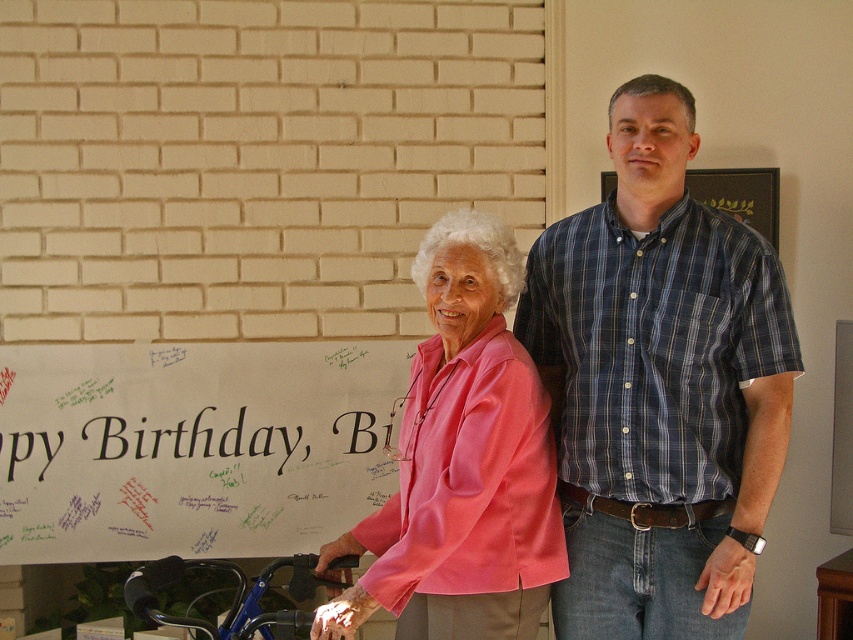
Question: Does blue plaid shirt at center appear on the left side of matte wood frame at upper center?

Choices:
 (A) yes
 (B) no

Answer: (A)

Question: Which point is closer to the camera?

Choices:
 (A) pos(712,177)
 (B) pos(405,442)
 (C) pos(607,429)
 (D) pos(271,563)

Answer: (C)

Question: Which point is closer to the camera?

Choices:
 (A) black paper banner at center
 (B) matte wood frame at upper center
 (C) pink satin blouse at center

Answer: (C)

Question: Which of the following is the farthest from the observer?

Choices:
 (A) blue plastic wheelchair at lower left
 (B) matte wood frame at upper center
 (C) black paper banner at center
 (D) pink satin blouse at center

Answer: (B)

Question: Is pink satin blouse at center to the left of black paper banner at center from the viewer's perspective?

Choices:
 (A) no
 (B) yes

Answer: (A)

Question: Does blue plaid shirt at center appear over pink satin blouse at center?

Choices:
 (A) yes
 (B) no

Answer: (A)